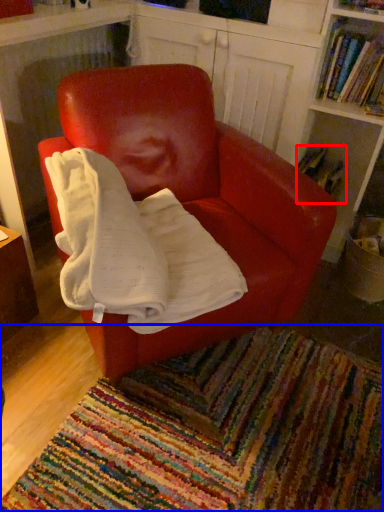
Question: Which object appears closest to the camera in this image, book (highlighted by a red box) or mat (highlighted by a blue box)?

Choices:
 (A) book
 (B) mat

Answer: (B)